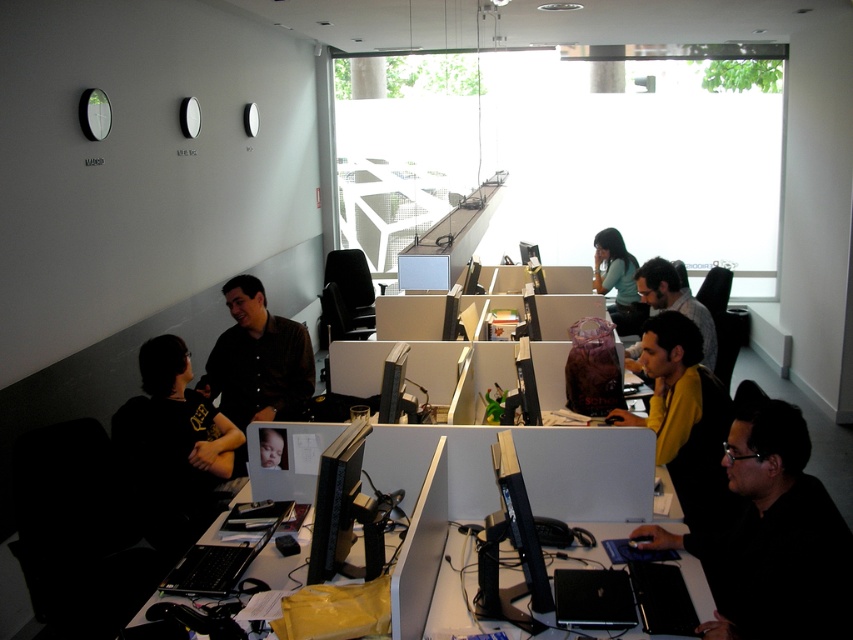
Question: Does matte brown shirt at center appear under smooth skin baby at center?

Choices:
 (A) no
 (B) yes

Answer: (A)

Question: Which object is the closest to the matte brown shirt at center?

Choices:
 (A) black plastic table at lower right
 (B) black plastic monitor at center
 (C) matte black laptop at center

Answer: (A)

Question: Does black matte shirt at left appear on the left side of matte brown shirt at center?

Choices:
 (A) yes
 (B) no

Answer: (A)

Question: Which object is the closest to the yellow matte shirt at center?

Choices:
 (A) smooth skin baby at center
 (B) black plastic table at lower right
 (C) matte teal shirt at center
 (D) black matte laptop at lower right

Answer: (D)

Question: Can you confirm if matte brown shirt at center is bigger than matte black laptop at center?

Choices:
 (A) no
 (B) yes

Answer: (B)

Question: Estimate the real-world distances between objects in this image. Which object is closer to the yellow matte shirt at center?

Choices:
 (A) black plastic monitor at center
 (B) matte black laptop at center
 (C) matte brown shirt at center

Answer: (B)